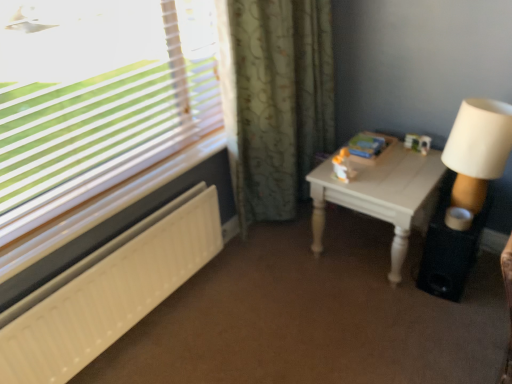
Locate an element on the screen. The height and width of the screenshot is (384, 512). green floral fabric curtain at center is located at coordinates (279, 102).

What is the approximate height of black matte speaker at lower right?

black matte speaker at lower right is 12.66 inches tall.

What are the coordinates of `white wood table at right` in the screenshot? It's located at (382, 194).

Identify the location of green floral fabric curtain at center. The image size is (512, 384). (279, 102).

Considering the relative sizes of black matte speaker at lower right and green floral fabric curtain at center in the image provided, is black matte speaker at lower right wider than green floral fabric curtain at center?

Yes, black matte speaker at lower right is wider than green floral fabric curtain at center.

From the image's perspective, between black matte speaker at lower right and green floral fabric curtain at center, which one is located above?

green floral fabric curtain at center is shown above in the image.

Who is taller, black matte speaker at lower right or green floral fabric curtain at center?

Standing taller between the two is green floral fabric curtain at center.

Looking at the image, does green floral fabric curtain at center seem bigger or smaller compared to white textured radiator at lower left?

Considering their sizes, green floral fabric curtain at center takes up more space than white textured radiator at lower left.

The width and height of the screenshot is (512, 384). Identify the location of radiator that is below the green floral fabric curtain at center (from the image's perspective). (108, 291).

Is green floral fabric curtain at center positioned beyond the bounds of white textured radiator at lower left?

Indeed, green floral fabric curtain at center is completely outside white textured radiator at lower left.

From a real-world perspective, is green floral fabric curtain at center on white textured radiator at lower left?

Yes, from a real-world perspective, green floral fabric curtain at center is above white textured radiator at lower left.

Is black matte speaker at lower right aimed at white wood table at right?

No, black matte speaker at lower right is not facing towards white wood table at right.

Between black matte speaker at lower right and white wood table at right, which one has smaller size?

black matte speaker at lower right.

From a real-world perspective, is black matte speaker at lower right positioned over white wood table at right based on gravity?

No, from a real-world perspective, black matte speaker at lower right is not over white wood table at right

Are black matte speaker at lower right and white wood table at right located far from each other?

black matte speaker at lower right is near white wood table at right, not far away.

Is white wood table at right located outside black matte speaker at lower right?

Yes, white wood table at right is located beyond the bounds of black matte speaker at lower right.

Between white wood table at right and black matte speaker at lower right, which one appears on the right side from the viewer's perspective?

black matte speaker at lower right.

Consider the image. From the image's perspective, which one is positioned lower, white wood table at right or black matte speaker at lower right?

From the image's view, black matte speaker at lower right is below.

Is white wood table at right placed right next to black matte speaker at lower right?

There is a gap between white wood table at right and black matte speaker at lower right.

Considering the positions of points (132, 287) and (277, 126), is point (132, 287) farther from camera compared to point (277, 126)?

No.

In terms of height, does white textured radiator at lower left look taller or shorter compared to green floral fabric curtain at center?

Clearly, white textured radiator at lower left is shorter compared to green floral fabric curtain at center.

Is white textured radiator at lower left facing towards green floral fabric curtain at center?

No, white textured radiator at lower left is not oriented towards green floral fabric curtain at center.

Considering the positions of point (422, 161) and point (142, 277), is point (422, 161) closer or farther from the camera than point (142, 277)?

Point (422, 161) is positioned farther from the camera compared to point (142, 277).

Is white wood table at right to the right of white textured radiator at lower left from the viewer's perspective?

Yes.

Considering the relative sizes of white wood table at right and white textured radiator at lower left in the image provided, is white wood table at right wider than white textured radiator at lower left?

Indeed, white wood table at right has a greater width compared to white textured radiator at lower left.

Does white wood table at right have a larger size compared to white textured radiator at lower left?

Yes.

Based on the photo, can you confirm if white textured radiator at lower left is wider than white wood table at right?

Incorrect, the width of white textured radiator at lower left does not surpass that of white wood table at right.

Which is farther from the camera, (98, 351) or (319, 171)?

The point (319, 171) is more distant.

From the image's perspective, is white textured radiator at lower left on white wood table at right?

No, from the image's perspective, white textured radiator at lower left is not over white wood table at right.

Based on the photo, from a real-world perspective, relative to white wood table at right, is white textured radiator at lower left vertically above or below?

white textured radiator at lower left is situated lower than white wood table at right in the real world.

Locate an element on the screen. side table that appears below the green floral fabric curtain at center (from the image's perspective) is located at coordinates (450, 247).

Find the location of a particular element. curtain on the right side of white textured radiator at lower left is located at coordinates (279, 102).

From the image, which object appears to be nearer to black matte speaker at lower right, white wood table at right or green floral fabric curtain at center?

white wood table at right is closer to black matte speaker at lower right.

Based on their spatial positions, is green floral fabric curtain at center or white wood table at right closer to white textured radiator at lower left?

green floral fabric curtain at center.

Estimate the real-world distances between objects in this image. Which object is further from black matte speaker at lower right, white textured radiator at lower left or green floral fabric curtain at center?

Among the two, white textured radiator at lower left is located further to black matte speaker at lower right.

Which object lies further to the anchor point white textured radiator at lower left, green floral fabric curtain at center or black matte speaker at lower right?

Based on the image, black matte speaker at lower right appears to be further to white textured radiator at lower left.

From the image, which object appears to be nearer to white wood table at right, white textured radiator at lower left or black matte speaker at lower right?

black matte speaker at lower right is closer to white wood table at right.

Which object lies nearer to the anchor point green floral fabric curtain at center, white textured radiator at lower left or black matte speaker at lower right?

white textured radiator at lower left is closer to green floral fabric curtain at center.

Based on their spatial positions, is white wood table at right or black matte speaker at lower right further from green floral fabric curtain at center?

The object further to green floral fabric curtain at center is black matte speaker at lower right.

Considering their positions, is white wood table at right positioned further to black matte speaker at lower right than white textured radiator at lower left?

white textured radiator at lower left is further to black matte speaker at lower right.

Locate an element on the screen. Image resolution: width=512 pixels, height=384 pixels. table between green floral fabric curtain at center and black matte speaker at lower right in the horizontal direction is located at coordinates [x=382, y=194].

Locate an element on the screen. curtain situated between white textured radiator at lower left and black matte speaker at lower right from left to right is located at coordinates (279, 102).

This screenshot has width=512, height=384. I want to click on curtain between white textured radiator at lower left and white wood table at right from left to right, so click(279, 102).

Where is `table situated between white textured radiator at lower left and black matte speaker at lower right from left to right`? table situated between white textured radiator at lower left and black matte speaker at lower right from left to right is located at coordinates (382, 194).